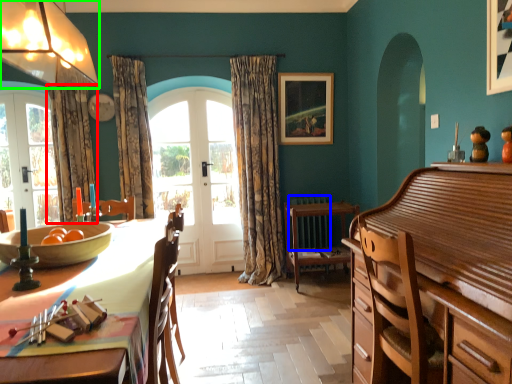
Question: Considering the real-world distances, which object is closest to curtain (highlighted by a red box)? radiator (highlighted by a blue box) or lamp (highlighted by a green box).

Choices:
 (A) radiator
 (B) lamp

Answer: (B)